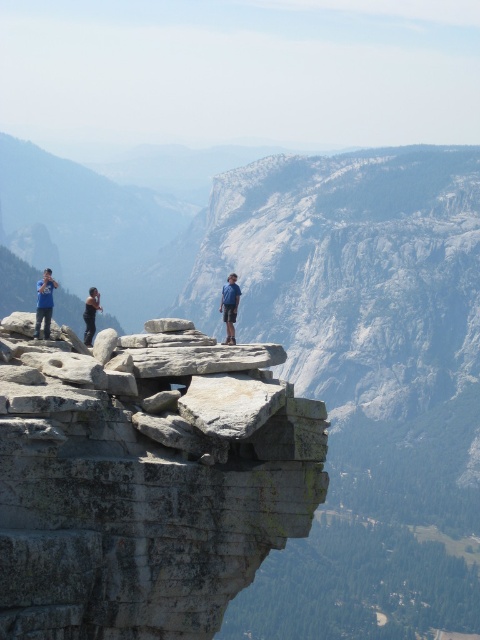
You are a photographer trying to capture the scenic view of the cliff. You notice two tourists wearing a matte blue shirt at left and a black fabric shirt at left. Which tourist is standing more to the left side?

The matte blue shirt at left is positioned on the left side of black fabric shirt at left, so the tourist wearing the matte blue shirt at left is standing more to the left side.

You are a photographer at the cliff edge. You notice two people wearing shirts at the left side of your frame. Which shirt, the matte blue shirt at left or the black fabric shirt at left, would appear bigger in your photo?

The matte blue shirt at left would appear bigger in the photo because it is larger in size than the black fabric shirt at left.